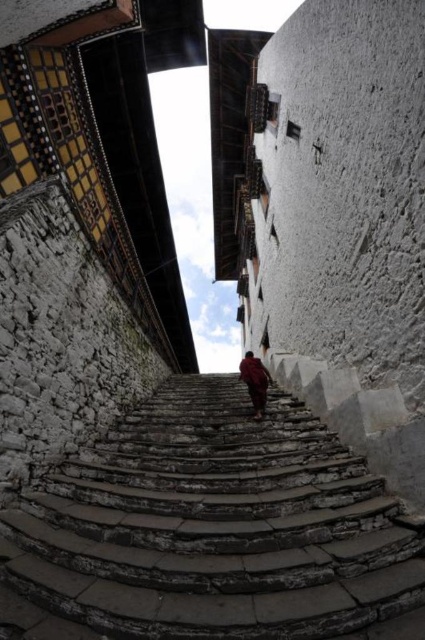
Question: Is stone stairs at center thinner than red woolen robe at center?

Choices:
 (A) no
 (B) yes

Answer: (A)

Question: Which point is closer to the camera taking this photo?

Choices:
 (A) (337, 536)
 (B) (255, 410)

Answer: (A)

Question: Is stone stairs at center closer to the viewer compared to red woolen robe at center?

Choices:
 (A) no
 (B) yes

Answer: (B)

Question: Which point is farther to the camera?

Choices:
 (A) stone stairs at center
 (B) red woolen robe at center

Answer: (B)

Question: Is stone stairs at center closer to camera compared to red woolen robe at center?

Choices:
 (A) no
 (B) yes

Answer: (B)